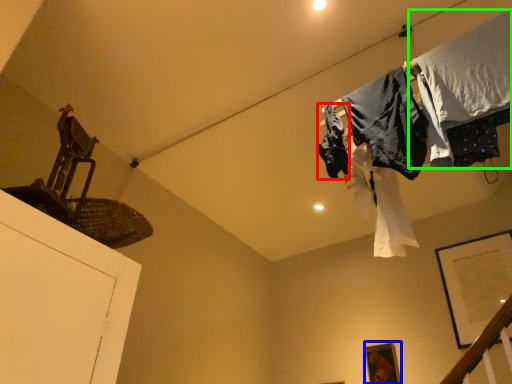
Question: Which object is positioned closest to clothing (highlighted by a red box)? Select from picture frame (highlighted by a blue box) and clothing (highlighted by a green box).

Choices:
 (A) picture frame
 (B) clothing

Answer: (B)